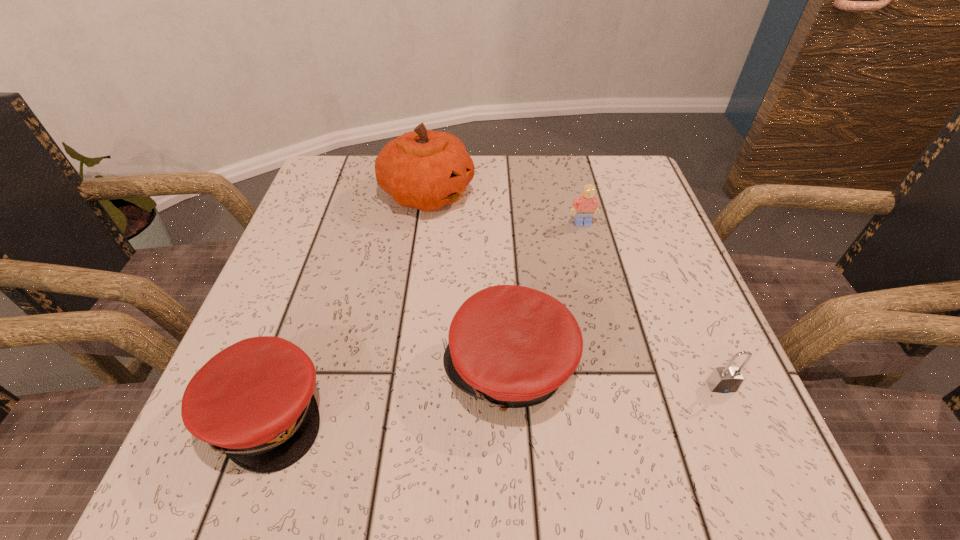
Find the location of `empty space that is in between the tallest object and the Lego`. empty space that is in between the tallest object and the Lego is located at coordinates [x=505, y=209].

Where is `object identified as the closest to the padlock`? The width and height of the screenshot is (960, 540). object identified as the closest to the padlock is located at coordinates (512, 346).

You are a GUI agent. You are given a task and a screenshot of the screen. Output one action in this format:
    pyautogui.click(x=<x>, y=<y>)
    Task: Click on the object that is the nearest to the padlock
    This screenshot has width=960, height=540.
    Given the screenshot: What is the action you would take?
    pyautogui.click(x=512, y=346)

This screenshot has width=960, height=540. Identify the location of vacant area that satisfies the following two spatial constraints: 1. on the front-facing side of the Lego; 2. on the front of the right cap with an emblem. (619, 368).

In order to click on free spot that satisfies the following two spatial constraints: 1. on the front-facing side of the Lego; 2. on the front-facing side of the left cap in this screenshot , I will do `click(631, 414)`.